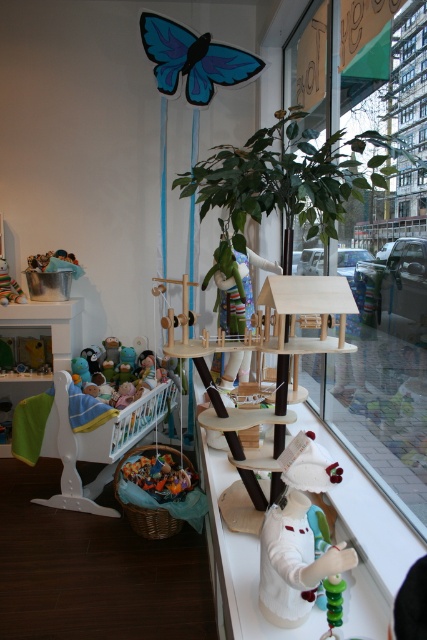
Is the position of green leafy plant at center more distant than that of white matte fireplace at left?

No, it is in front of white matte fireplace at left.

Does green leafy plant at center have a greater height compared to white matte fireplace at left?

Correct, green leafy plant at center is much taller as white matte fireplace at left.

Is point (350, 356) behind point (17, 310)?

No, it is in front of (17, 310).

Find the location of a particular element. The image size is (427, 640). green leafy plant at center is located at coordinates (383, 346).

Based on the photo, who is shorter, white matte rabbit at center or velvet plush monkey at left?

With less height is velvet plush monkey at left.

Is white matte rabbit at center behind velvet plush monkey at left?

No, it is not.

Does point (278, 602) come closer to viewer compared to point (20, 294)?

Yes, point (278, 602) is in front of point (20, 294).

Where is `white matte rabbit at center`? white matte rabbit at center is located at coordinates (298, 536).

Is point (73, 339) positioned behind point (5, 294)?

Yes, point (73, 339) is behind point (5, 294).

Which is in front, point (49, 323) or point (12, 280)?

Point (49, 323) is in front.

Locate an element on the screen. The width and height of the screenshot is (427, 640). white matte fireplace at left is located at coordinates (50, 324).